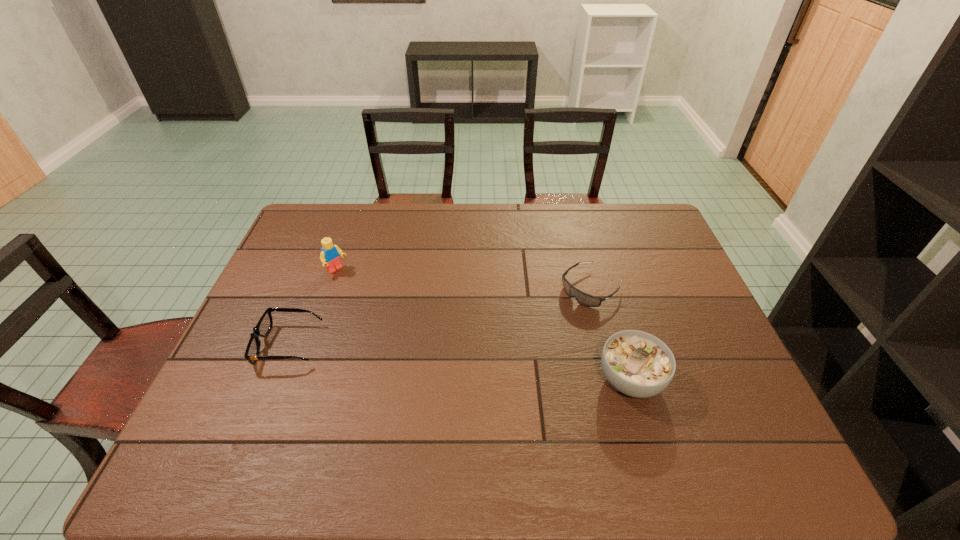
Where is `sunglasses`? sunglasses is located at coordinates (264, 325).

Find the location of a particular element. the third shortest object is located at coordinates (638, 364).

At what (x,y) coordinates should I click in order to perform the action: click on goggles. Please return your answer as a coordinate pair (x, y). Looking at the image, I should click on [x=582, y=298].

The width and height of the screenshot is (960, 540). In order to click on the tallest object in this screenshot , I will do `click(330, 254)`.

Locate an element on the screen. free location located 0.400m on the left of the soup bowl is located at coordinates (437, 380).

Where is `free space located on the lenses of the goggles`? free space located on the lenses of the goggles is located at coordinates (555, 317).

Locate an element on the screen. vacant space situated on the lenses of the goggles is located at coordinates [x=514, y=349].

Where is `vacant position located on the lenses of the goggles`? The width and height of the screenshot is (960, 540). vacant position located on the lenses of the goggles is located at coordinates (534, 333).

Find the location of a particular element. This screenshot has width=960, height=540. vacant region located 0.130m on the front-facing side of the Lego is located at coordinates (368, 296).

This screenshot has width=960, height=540. In order to click on free point located 0.310m on the front-facing side of the Lego in this screenshot , I will do `click(405, 329)`.